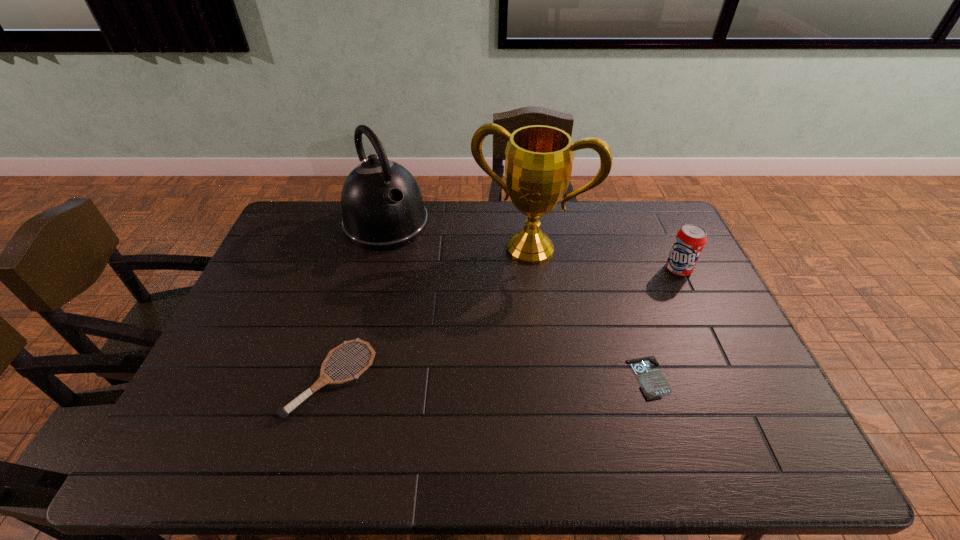
Find the location of `the fourth tallest object`. the fourth tallest object is located at coordinates (283, 412).

Identify the location of the second object from right to left. This screenshot has height=540, width=960. (654, 385).

In order to click on the shortest object in this screenshot , I will do `click(654, 385)`.

Image resolution: width=960 pixels, height=540 pixels. What are the coordinates of `the third object from left to right` in the screenshot? It's located at (538, 166).

You are a GUI agent. You are given a task and a screenshot of the screen. Output one action in this format:
    pyautogui.click(x=<x>, y=<y>)
    Task: Click on the rightmost object
    The height and width of the screenshot is (540, 960).
    Given the screenshot: What is the action you would take?
    pyautogui.click(x=690, y=240)

What are the coordinates of `soda can` in the screenshot? It's located at (690, 240).

Where is `kettle`? Image resolution: width=960 pixels, height=540 pixels. kettle is located at coordinates (382, 206).

Image resolution: width=960 pixels, height=540 pixels. Find the location of `free spot located on the left of the fourth tallest object`. free spot located on the left of the fourth tallest object is located at coordinates (202, 379).

Identify the location of vacant region located on the back of the shortest object. (623, 296).

Find the location of a particular element. This screenshot has height=540, width=960. free space located on the front-facing side of the award is located at coordinates (483, 351).